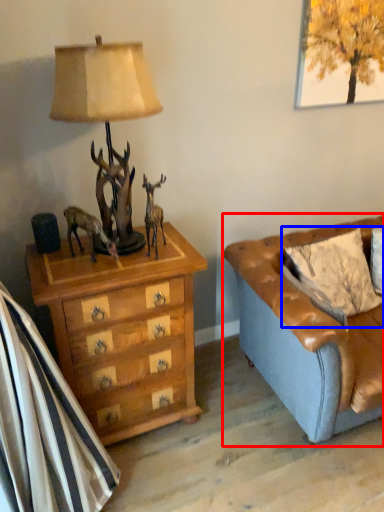
Question: Which point is closer to the camera, studio couch (highlighted by a red box) or pillow (highlighted by a blue box)?

Choices:
 (A) studio couch
 (B) pillow

Answer: (A)